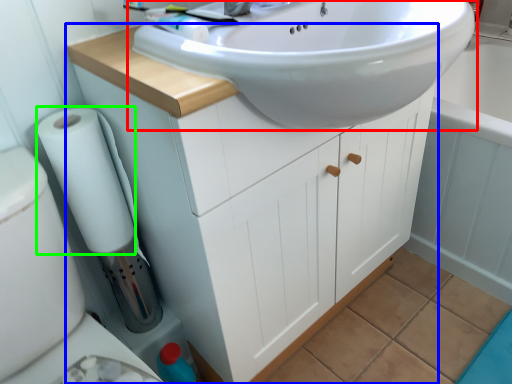
Question: Considering the real-world distances, which object is closest to sink (highlighted by a red box)? bathroom cabinet (highlighted by a blue box) or toilet paper (highlighted by a green box).

Choices:
 (A) bathroom cabinet
 (B) toilet paper

Answer: (A)